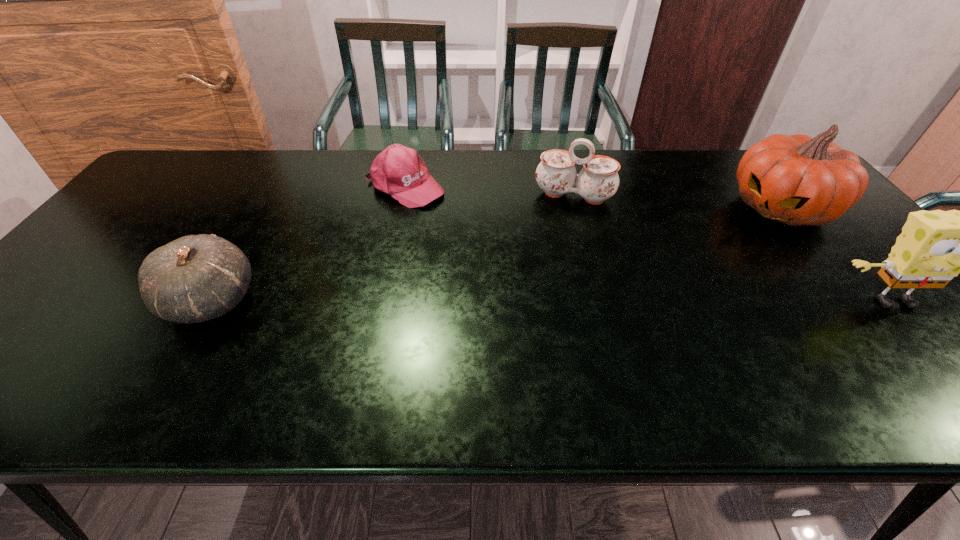
Where is `free region located by the handle of the chinaware`? This screenshot has width=960, height=540. free region located by the handle of the chinaware is located at coordinates coord(551,266).

At what (x,y) coordinates should I click in order to perform the action: click on vacant region located 0.230m by the handle of the chinaware. Please return your answer as a coordinate pair (x, y). Looking at the image, I should click on (552, 263).

You are a GUI agent. You are given a task and a screenshot of the screen. Output one action in this format:
    pyautogui.click(x=<x>, y=<y>)
    Task: Click on the vacant area located at the front of the shortest object with the brim
    The height and width of the screenshot is (540, 960).
    Given the screenshot: What is the action you would take?
    pyautogui.click(x=497, y=241)

Locate an element on the screen. vacant region located 0.150m at the front of the shortest object with the brim is located at coordinates (468, 224).

Locate an element on the screen. The image size is (960, 540). free space located at the front of the shortest object with the brim is located at coordinates (512, 250).

This screenshot has height=540, width=960. Find the location of `pumpkin present at the far edge`. pumpkin present at the far edge is located at coordinates (797, 180).

The width and height of the screenshot is (960, 540). Identify the location of chinaware present at the far edge. (556, 175).

Identify the location of baseball cap that is positioned at the far edge. The height and width of the screenshot is (540, 960). (398, 171).

Locate an element on the screen. object at the near edge is located at coordinates (195, 278).

Find the location of a particular element. object located in the right edge section of the desktop is located at coordinates (797, 180).